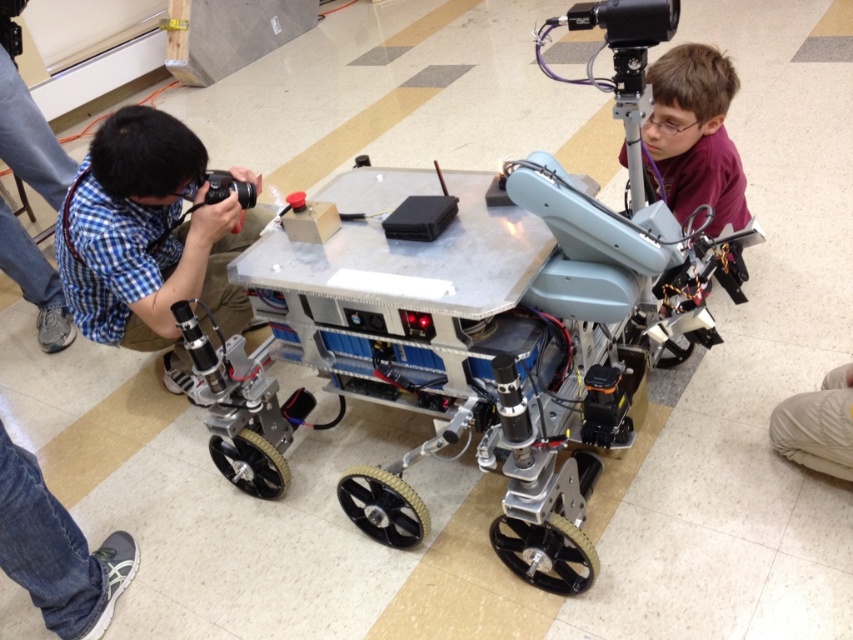
You are standing at point (271, 433) and want to take a photo of the robotic rover. The camera you are using has a minimum focusing distance of 5 feet. Can you take a clear photo of the robotic rover from your current position?

The distance between point (271, 433) and the camera is 6.79 feet, which is greater than the camera minimum focusing distance of 5 feet. Therefore, you can take a clear photo of the robotic rover from your current position.

You are a maintenance technician in a workshop. You need to access the control panel on the metallic robot at center, which is currently obstructed by the jeans at lower left. Can you reach the control panel without moving the jeans?

The metallic robot at center is closer to the viewer than the jeans at lower left, so the control panel on the metallic robot at center should be accessible without needing to move the jeans at lower left.